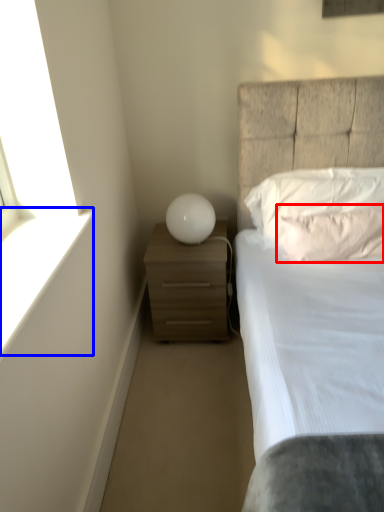
Question: Which of the following is the farthest to the observer, pillow (highlighted by a red box) or window sill (highlighted by a blue box)?

Choices:
 (A) pillow
 (B) window sill

Answer: (A)